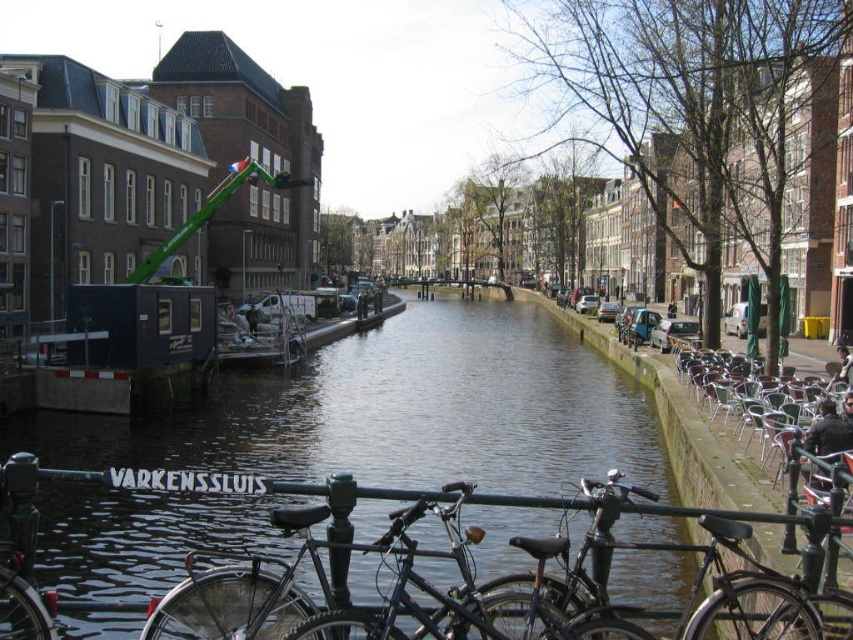
You are a tourist visiting the canal and want to take a photo of the smooth concrete water at center and the shiny black bicycle at center. If you want to include both objects in the frame, which one should be placed closer to the edge of the photo to ensure both fit?

The shiny black bicycle at center should be placed closer to the edge of the photo because the smooth concrete water at center is wider, so it requires more space in the frame to accommodate its larger width compared to the bicycle.

You are standing on the bridge overlooking the canal and want to take a photo of both the smooth concrete water at center and the shiny black bicycle at center. Which object should you focus on first to ensure both are in the frame?

You should focus on the shiny black bicycle at center first because it is closer to you than the smooth concrete water at center, which is further away. By focusing on the closer object, the farther one will still be in focus due to depth of field.